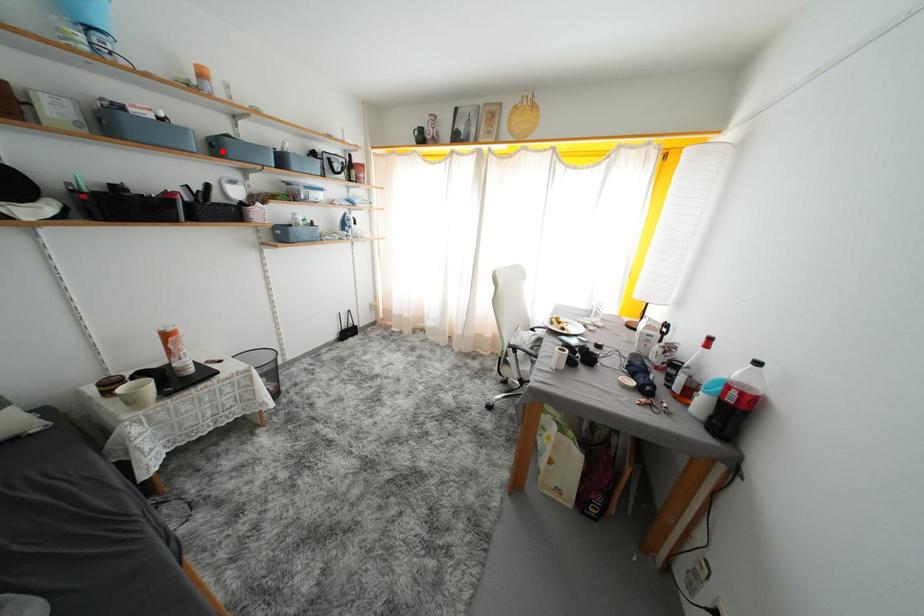
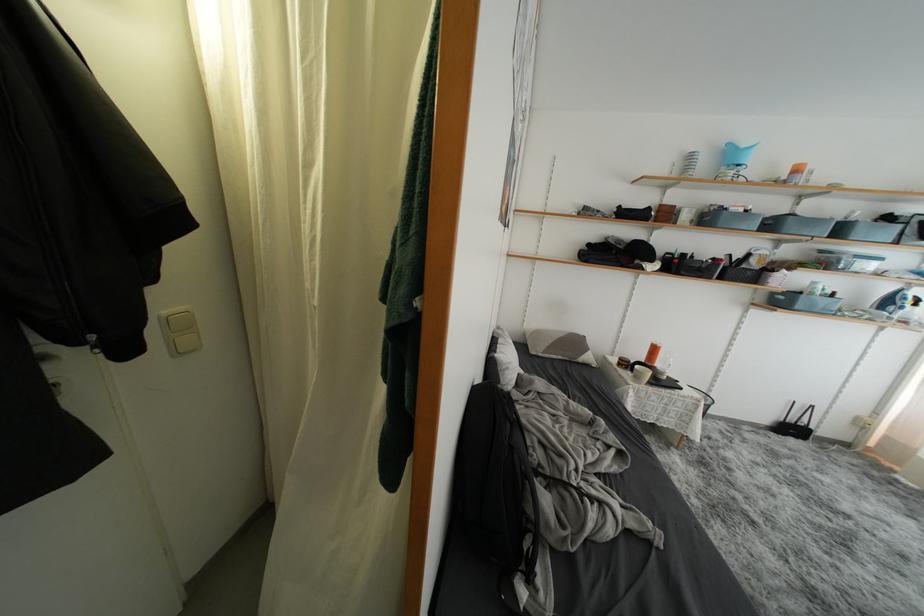
Locate, in the second image, the point that corresponds to the highlighted location in the first image.

(777, 229)